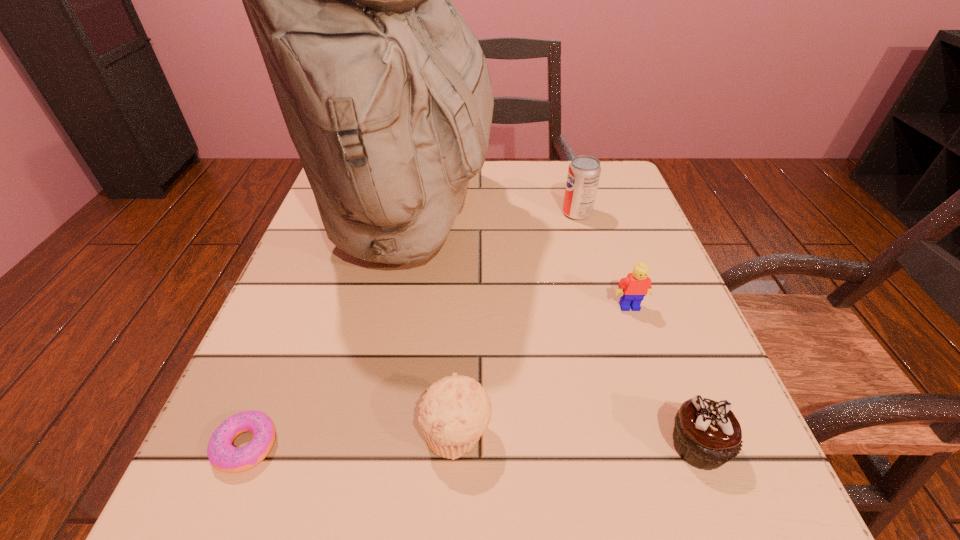
This screenshot has height=540, width=960. I want to click on Lego at the right edge, so click(633, 288).

This screenshot has height=540, width=960. Identify the location of cupcake that is at the right edge. (707, 434).

This screenshot has width=960, height=540. Find the location of `object located in the far left corner section of the desktop`. object located in the far left corner section of the desktop is located at coordinates (385, 91).

Locate an element on the screen. This screenshot has width=960, height=540. object located in the near left corner section of the desktop is located at coordinates (226, 458).

Where is `object that is at the far right corner`? Image resolution: width=960 pixels, height=540 pixels. object that is at the far right corner is located at coordinates (584, 171).

Find the location of a particular element. object positioned at the near right corner is located at coordinates (707, 434).

Where is `free space at the far edge`? The width and height of the screenshot is (960, 540). free space at the far edge is located at coordinates (496, 190).

This screenshot has height=540, width=960. In the image, there is a desktop. What are the coordinates of `vacant region at the left edge` in the screenshot? It's located at (333, 310).

In the image, there is a desktop. At what (x,y) coordinates should I click in order to perform the action: click on free space at the right edge. Please return your answer as a coordinate pair (x, y). This screenshot has height=540, width=960. Looking at the image, I should click on (610, 374).

In the image, there is a desktop. Where is `vacant space at the far right corner`? This screenshot has height=540, width=960. vacant space at the far right corner is located at coordinates (601, 184).